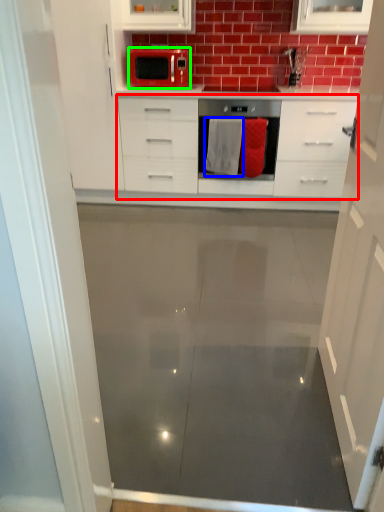
Question: Estimate the real-world distances between objects in this image. Which object is closer to chest of drawers (highlighted by a red box), material (highlighted by a blue box) or microwave oven (highlighted by a green box)?

Choices:
 (A) material
 (B) microwave oven

Answer: (A)